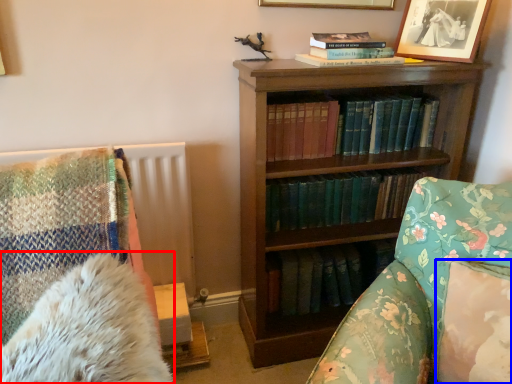
Question: Which point is further to the camera, chiffonier (highlighted by a red box) or pillow (highlighted by a blue box)?

Choices:
 (A) chiffonier
 (B) pillow

Answer: (B)